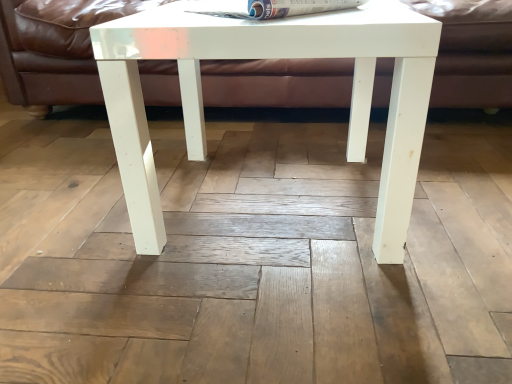
You are a GUI agent. You are given a task and a screenshot of the screen. Output one action in this format:
    pyautogui.click(x=<x>, y=<y>)
    Task: Click on the vacant space in front of white glossy magazine at upper center
    
    Given the screenshot: What is the action you would take?
    270,19